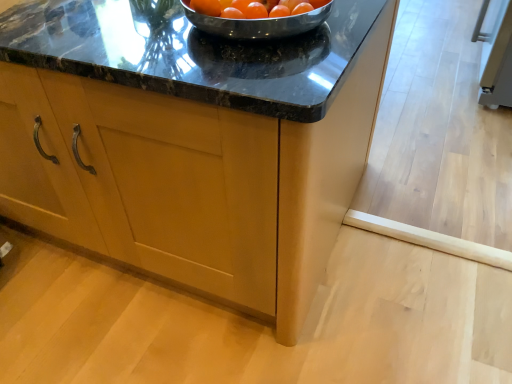
Question: Is orange matte tomato at center bigger or smaller than matte wood cabinet at center?

Choices:
 (A) big
 (B) small

Answer: (B)

Question: Would you say orange matte tomato at center is to the left or to the right of matte wood cabinet at center in the picture?

Choices:
 (A) right
 (B) left

Answer: (A)

Question: From the image's perspective, is orange matte tomato at center above or below matte wood cabinet at center?

Choices:
 (A) below
 (B) above

Answer: (B)

Question: Considering the positions of matte wood cabinet at center and orange matte tomato at center in the image, is matte wood cabinet at center taller or shorter than orange matte tomato at center?

Choices:
 (A) tall
 (B) short

Answer: (A)

Question: Looking at the image, does matte wood cabinet at center seem bigger or smaller compared to orange matte tomato at center?

Choices:
 (A) small
 (B) big

Answer: (B)

Question: Is point (30, 127) positioned closer to the camera than point (272, 4)?

Choices:
 (A) closer
 (B) farther

Answer: (B)

Question: From the image's perspective, is matte wood cabinet at center located above or below orange matte tomato at center?

Choices:
 (A) below
 (B) above

Answer: (A)